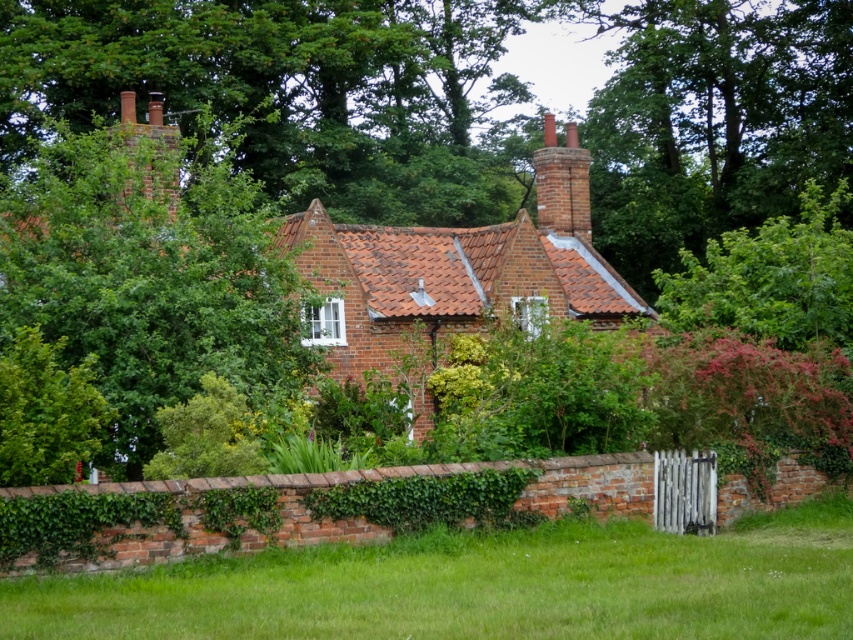
From the picture: Is green leafy tree at upper left wider than green leafy hedge at left?

Yes, green leafy tree at upper left is wider than green leafy hedge at left.

Is green leafy tree at upper left positioned in front of green leafy hedge at left?

No, it is not.

Locate an element on the screen. The width and height of the screenshot is (853, 640). green leafy tree at upper left is located at coordinates (149, 276).

You are a GUI agent. You are given a task and a screenshot of the screen. Output one action in this format:
    pyautogui.click(x=<x>, y=<y>)
    Task: Click on the green leafy tree at upper left
    This screenshot has height=640, width=853.
    Given the screenshot: What is the action you would take?
    pyautogui.click(x=149, y=276)

Who is positioned more to the left, green grass at lower center or green leafy hedge at lower left?

green leafy hedge at lower left

Is green grass at lower center closer to camera compared to green leafy hedge at lower left?

Yes, green grass at lower center is in front of green leafy hedge at lower left.

Describe the element at coordinates (479, 586) in the screenshot. I see `green grass at lower center` at that location.

You are a GUI agent. You are given a task and a screenshot of the screen. Output one action in this format:
    pyautogui.click(x=<x>, y=<y>)
    Task: Click on the green grass at lower center
    The image size is (853, 640).
    Given the screenshot: What is the action you would take?
    pyautogui.click(x=479, y=586)

Does brick cottage at center have a lesser height compared to green leafy hedge at lower left?

No.

Is point (80, 138) positioned before point (206, 404)?

No, (80, 138) is behind (206, 404).

Is point (579, 273) in front of point (181, 477)?

No, (579, 273) is behind (181, 477).

This screenshot has width=853, height=640. Find the location of `brick cottage at center`. brick cottage at center is located at coordinates click(x=369, y=321).